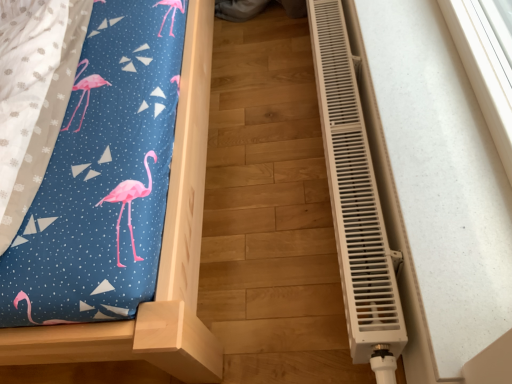
Question: Considering the positions of wooden bed frame at left and white plastic radiator at right in the image, is wooden bed frame at left taller or shorter than white plastic radiator at right?

Choices:
 (A) tall
 (B) short

Answer: (A)

Question: From the image's perspective, is wooden bed frame at left located above or below white plastic radiator at right?

Choices:
 (A) above
 (B) below

Answer: (A)

Question: Relative to white plastic radiator at right, is wooden bed frame at left in front or behind?

Choices:
 (A) behind
 (B) front

Answer: (B)

Question: From a real-world perspective, is white plastic radiator at right physically located above or below wooden bed frame at left?

Choices:
 (A) above
 (B) below

Answer: (B)

Question: Is point (337, 216) positioned closer to the camera than point (87, 344)?

Choices:
 (A) farther
 (B) closer

Answer: (A)

Question: Is white plastic radiator at right to the left or to the right of wooden bed frame at left in the image?

Choices:
 (A) right
 (B) left

Answer: (A)

Question: Is white plastic radiator at right bigger or smaller than wooden bed frame at left?

Choices:
 (A) small
 (B) big

Answer: (A)